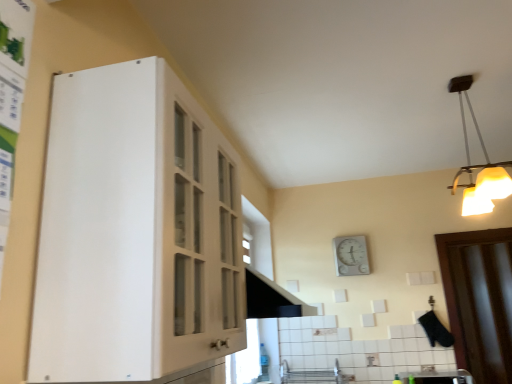
What are the coordinates of `empty space that is ontop of white plastic light fixture at upper right` in the screenshot? It's located at (461, 75).